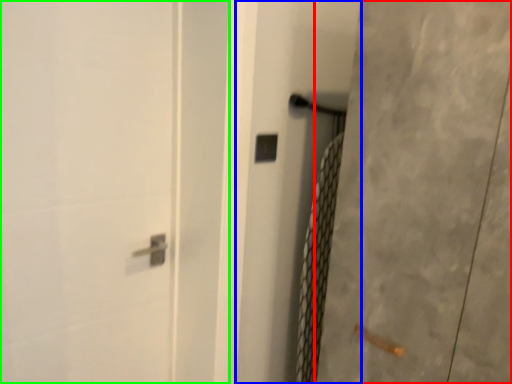
Question: Estimate the real-world distances between objects in this image. Which object is closer to screen door (highlighted by a red box), screen door (highlighted by a blue box) or screen door (highlighted by a green box)?

Choices:
 (A) screen door
 (B) screen door

Answer: (A)